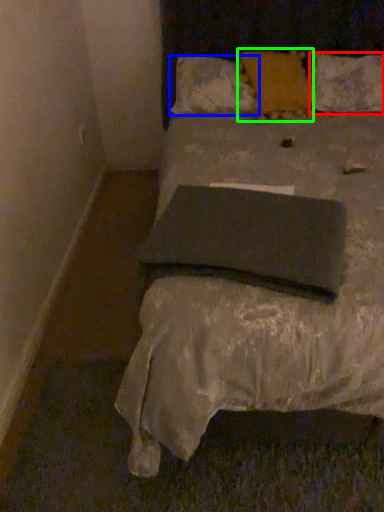
Question: Which object is the closest to the pillow (highlighted by a red box)? Choose among these: pillow (highlighted by a blue box) or pillow (highlighted by a green box).

Choices:
 (A) pillow
 (B) pillow

Answer: (B)